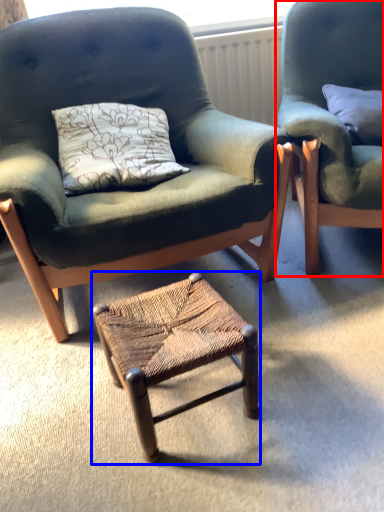
Question: Which point is closer to the camera, chair (highlighted by a red box) or stool (highlighted by a blue box)?

Choices:
 (A) chair
 (B) stool

Answer: (B)